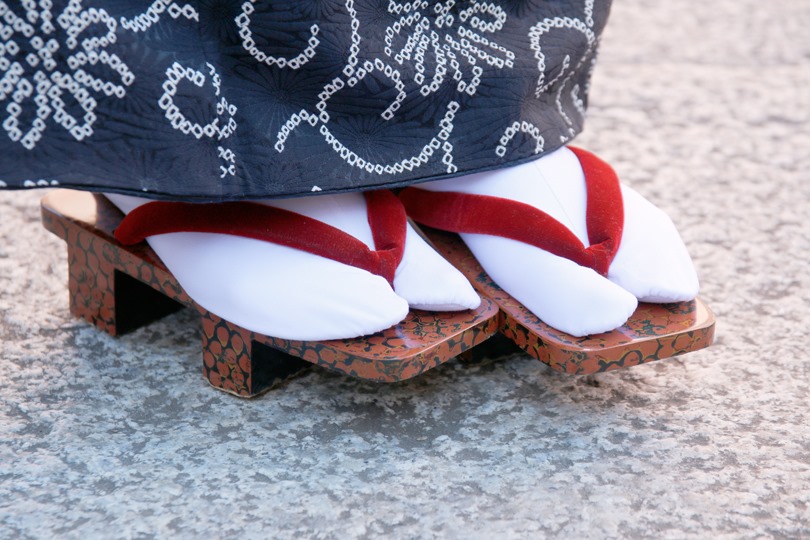
This screenshot has width=810, height=540. In order to click on sock in this screenshot , I will do `click(446, 292)`, `click(546, 275)`.